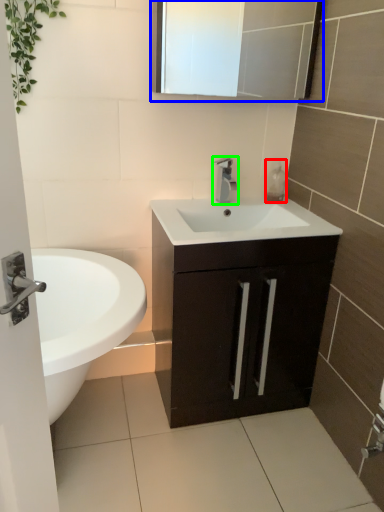
Question: Based on their relative distances, which object is farther from soap dispenser (highlighted by a red box)? Choose from medicine cabinet (highlighted by a blue box) and tap (highlighted by a green box).

Choices:
 (A) medicine cabinet
 (B) tap

Answer: (A)